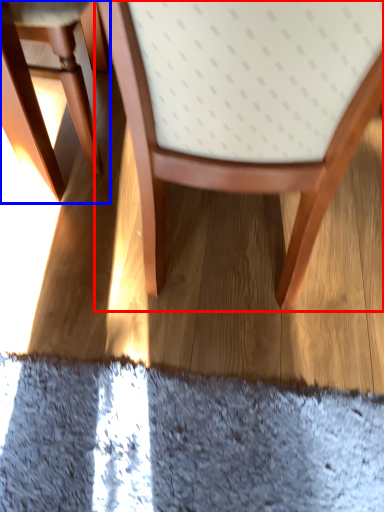
Question: Which of the following is the farthest to the observer, chair (highlighted by a red box) or chair (highlighted by a blue box)?

Choices:
 (A) chair
 (B) chair

Answer: (B)